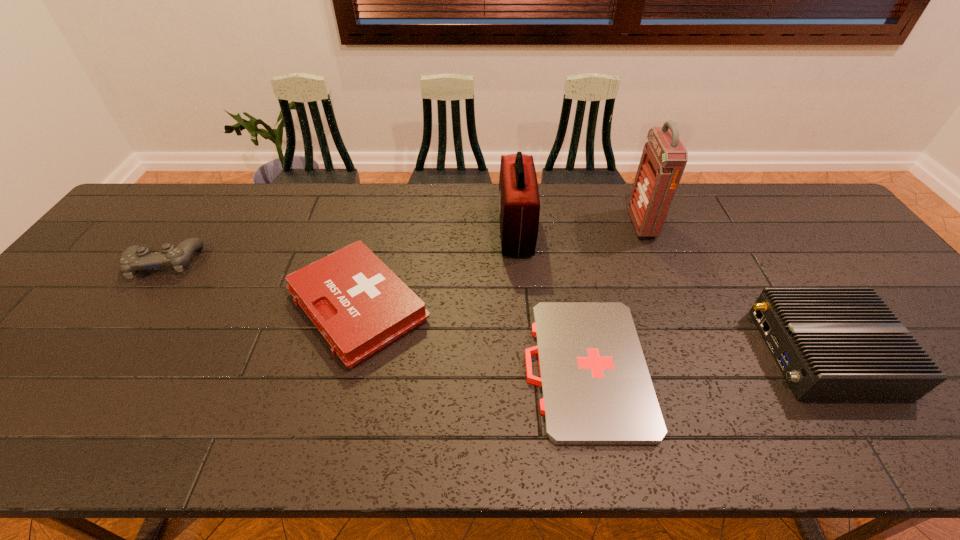
Identify which object is the fourth nearest to the shortest object. Please provide its 2D coordinates. Your answer should be formatted as a tuple, i.e. [(x, y)], where the tuple contains the x and y coordinates of a point satisfying the conditions above.

[(832, 344)]

This screenshot has height=540, width=960. Find the location of `object that stands as the fifth closest to the second tallest first-aid kit`. object that stands as the fifth closest to the second tallest first-aid kit is located at coordinates coord(134,258).

Select which first-aid kit is the second closest to the control. Please provide its 2D coordinates. Your answer should be formatted as a tuple, i.e. [(x, y)], where the tuple contains the x and y coordinates of a point satisfying the conditions above.

[(519, 205)]

This screenshot has width=960, height=540. I want to click on the first-aid kit that is the closest to the leftmost first-aid kit, so click(x=519, y=205).